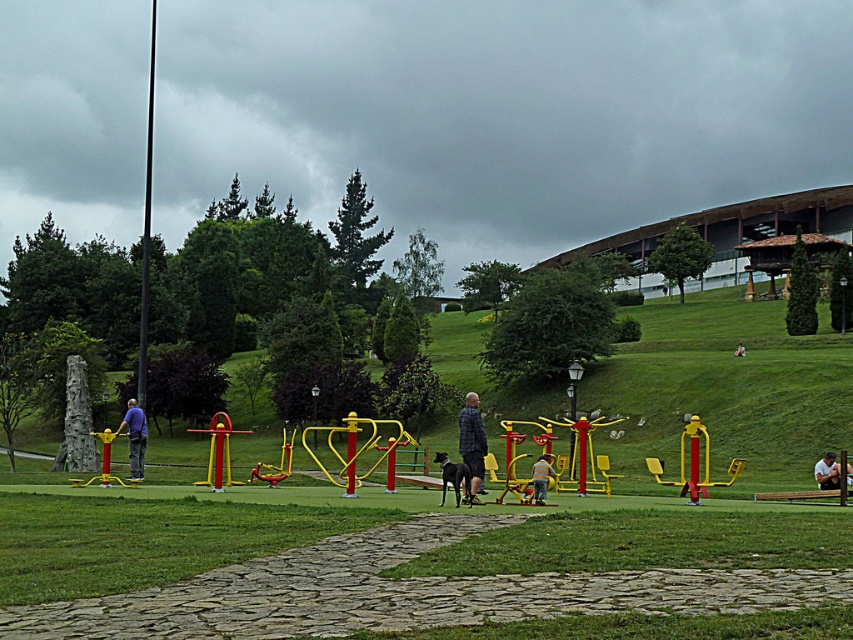
Question: Which of the following is the closest to the observer?

Choices:
 (A) (537, 502)
 (B) (132, 477)
 (C) (836, 476)
 (D) (476, 449)

Answer: (D)

Question: Among these points, which one is farthest from the camera?

Choices:
 (A) (134, 436)
 (B) (734, 353)
 (C) (830, 477)

Answer: (B)

Question: From the image, what is the correct spatial relationship of plaid fabric jacket at center in relation to white fabric shirt at center?

Choices:
 (A) above
 (B) below

Answer: (A)

Question: From the image, what is the correct spatial relationship of matte blue shirt at center in relation to white cotton shirt at center?

Choices:
 (A) left
 (B) right

Answer: (A)

Question: Which of the following is the farthest from the observer?

Choices:
 (A) (741, 349)
 (B) (837, 476)
 (C) (468, 410)

Answer: (A)

Question: Can you confirm if matte blue shirt at center is positioned to the left of matte yellow exercise machine at center?

Choices:
 (A) yes
 (B) no

Answer: (A)